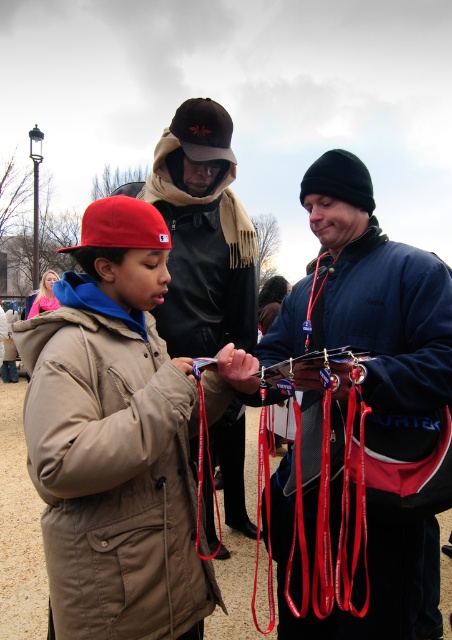
You are a tailor who needs to determine which jacket requires more fabric for alterations. Based on the image, which jacket between the matte khaki jacket at center and the dark brown leather jacket at center would need more fabric due to its larger size?

The dark brown leather jacket at center requires more fabric for alterations because its width is greater than the matte khaki jacket at center.

You are a photographer trying to capture a portrait of the velvet blue jacket at center and the dark brown leather jacket at center. Since you want both jackets to be clearly visible in the photo, which jacket should you focus on to ensure the other remains in the background?

You should focus on the velvet blue jacket at center because it is in front of the dark brown leather jacket at center, so focusing on it will keep the dark brown leather jacket at center in the background.

You are a fashion designer observing the two jackets in the image. Which jacket, the matte khaki jacket at center or the dark brown leather jacket at center, has a greater height?

The matte khaki jacket at center is taller than the dark brown leather jacket at center.